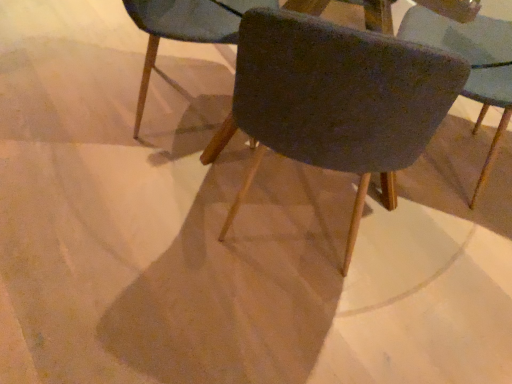
Identify the location of vacant area that is in front of velvet dark blue chair at center, the 3th chair from the right. The width and height of the screenshot is (512, 384). (138, 189).